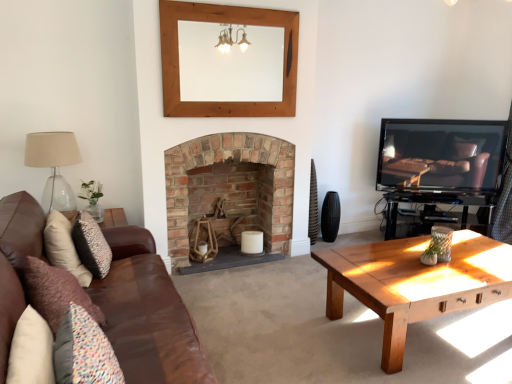
Question: Is rustic brick fireplace at center surrounded by wooden mirror at upper center?

Choices:
 (A) yes
 (B) no

Answer: (B)

Question: From a real-world perspective, does wooden mirror at upper center stand above rustic brick fireplace at center?

Choices:
 (A) yes
 (B) no

Answer: (A)

Question: Is wooden mirror at upper center outside rustic brick fireplace at center?

Choices:
 (A) no
 (B) yes

Answer: (B)

Question: Is rustic brick fireplace at center at the back of wooden mirror at upper center?

Choices:
 (A) no
 (B) yes

Answer: (A)

Question: Does wooden mirror at upper center have a greater height compared to rustic brick fireplace at center?

Choices:
 (A) no
 (B) yes

Answer: (A)

Question: From the image's perspective, is wooden mirror at upper center on rustic brick fireplace at center?

Choices:
 (A) yes
 (B) no

Answer: (A)

Question: Is the position of black matte speaker at center less distant than that of wooden mirror at upper center?

Choices:
 (A) yes
 (B) no

Answer: (B)

Question: Is wooden mirror at upper center at the back of black matte speaker at center?

Choices:
 (A) yes
 (B) no

Answer: (B)

Question: Considering the relative sizes of black matte speaker at center and wooden mirror at upper center in the image provided, is black matte speaker at center taller than wooden mirror at upper center?

Choices:
 (A) no
 (B) yes

Answer: (A)

Question: Can you confirm if black matte speaker at center is wider than wooden mirror at upper center?

Choices:
 (A) yes
 (B) no

Answer: (A)

Question: Does black matte speaker at center contain wooden mirror at upper center?

Choices:
 (A) no
 (B) yes

Answer: (A)

Question: Does black matte speaker at center come behind wooden mirror at upper center?

Choices:
 (A) yes
 (B) no

Answer: (A)

Question: From the image's perspective, would you say velvet purple pillow at left, which is the 1th pillow from front to back, is positioned over black matte speaker at center?

Choices:
 (A) no
 (B) yes

Answer: (A)